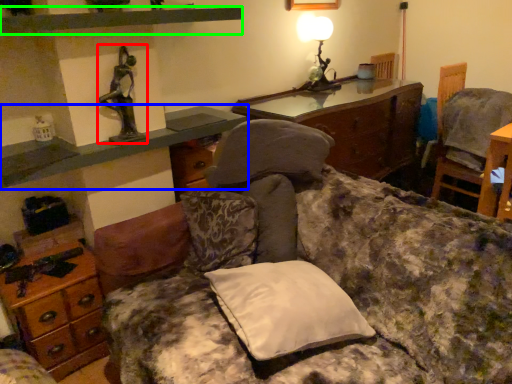
Question: Estimate the real-world distances between objects in this image. Which object is closer to person (highlighted by a red box), cabinetry (highlighted by a blue box) or shelf (highlighted by a green box)?

Choices:
 (A) cabinetry
 (B) shelf

Answer: (A)